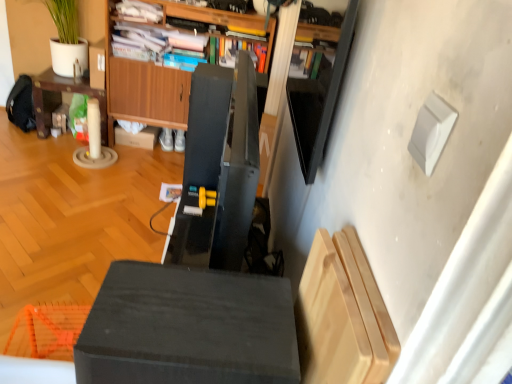
Image resolution: width=512 pixels, height=384 pixels. I want to click on vacant area on top of matte black cube at center (from a real-world perspective), so click(197, 310).